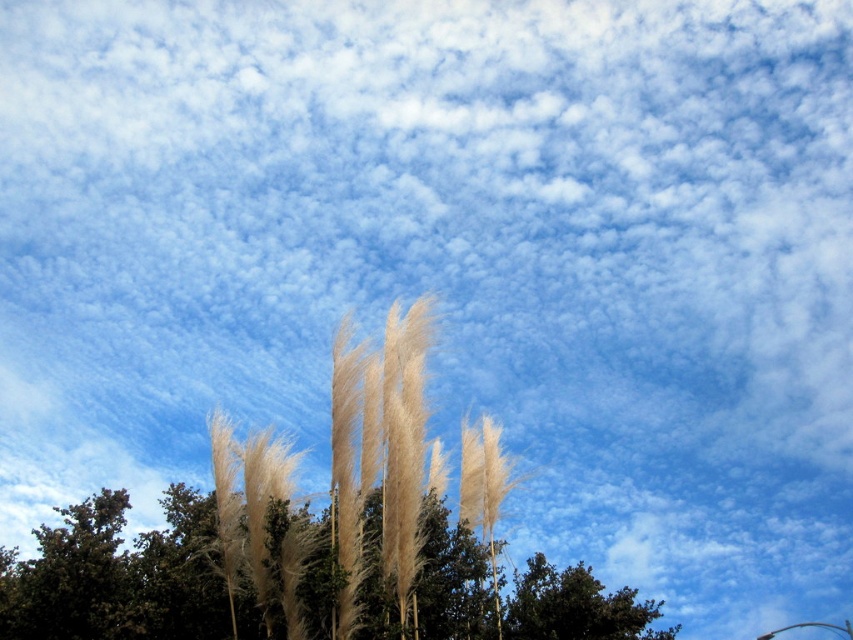
Question: Which point is closer to the camera?

Choices:
 (A) (552, 636)
 (B) (115, 580)

Answer: (B)

Question: Is silvery grass at center to the left of dark green leafy tree at lower center from the viewer's perspective?

Choices:
 (A) no
 (B) yes

Answer: (B)

Question: Among these objects, which one is farthest from the camera?

Choices:
 (A) dark green leafy tree at lower center
 (B) silvery grass at center

Answer: (A)

Question: Is silvery grass at center below dark green leafy tree at lower center?

Choices:
 (A) no
 (B) yes

Answer: (A)

Question: Can you confirm if silvery grass at center is wider than dark green leafy tree at lower center?

Choices:
 (A) yes
 (B) no

Answer: (A)